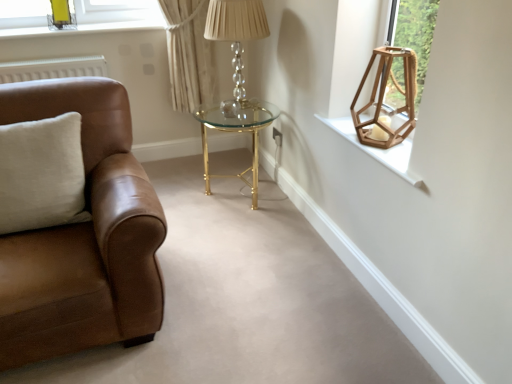
Question: Does crystal glass table lamp at center lie in front of wooden hexagonal lantern at upper right, the 1th lamp in the front-to-back sequence?

Choices:
 (A) no
 (B) yes

Answer: (A)

Question: Can you confirm if crystal glass table lamp at center is wider than wooden hexagonal lantern at upper right, the 1th lamp in the front-to-back sequence?

Choices:
 (A) no
 (B) yes

Answer: (B)

Question: Does crystal glass table lamp at center have a larger size compared to wooden hexagonal lantern at upper right, the 1th lamp positioned from the right?

Choices:
 (A) yes
 (B) no

Answer: (A)

Question: Is crystal glass table lamp at center at the right side of wooden hexagonal lantern at upper right, marked as the second lamp in a back-to-front arrangement?

Choices:
 (A) yes
 (B) no

Answer: (B)

Question: Is crystal glass table lamp at center taller than wooden hexagonal lantern at upper right, the first lamp positioned from the bottom?

Choices:
 (A) yes
 (B) no

Answer: (A)

Question: From a real-world perspective, is gold metallic/glass table at center physically located above or below wooden hexagonal lantern at upper right?

Choices:
 (A) above
 (B) below

Answer: (B)

Question: Choose the correct answer: Is gold metallic/glass table at center inside wooden hexagonal lantern at upper right or outside it?

Choices:
 (A) outside
 (B) inside

Answer: (A)

Question: From the image's perspective, is gold metallic/glass table at center positioned above or below wooden hexagonal lantern at upper right?

Choices:
 (A) above
 (B) below

Answer: (A)

Question: Is gold metallic/glass table at center to the left or to the right of wooden hexagonal lantern at upper right in the image?

Choices:
 (A) right
 (B) left

Answer: (B)

Question: Choose the correct answer: Is crystal glass table lamp at center inside wooden hexagonal lantern at upper right or outside it?

Choices:
 (A) inside
 (B) outside

Answer: (B)

Question: In terms of height, does crystal glass table lamp at center look taller or shorter compared to wooden hexagonal lantern at upper right?

Choices:
 (A) short
 (B) tall

Answer: (B)

Question: Considering the relative positions of crystal glass table lamp at center and wooden hexagonal lantern at upper right in the image provided, is crystal glass table lamp at center to the left or to the right of wooden hexagonal lantern at upper right?

Choices:
 (A) right
 (B) left

Answer: (B)

Question: From the image's perspective, relative to wooden hexagonal lantern at upper right, is crystal glass table lamp at center above or below?

Choices:
 (A) below
 (B) above

Answer: (B)

Question: From the image's perspective, is crystal glass table lamp at center positioned above or below brown leather couch at left?

Choices:
 (A) below
 (B) above

Answer: (B)

Question: From their relative heights in the image, would you say crystal glass table lamp at center is taller or shorter than brown leather couch at left?

Choices:
 (A) tall
 (B) short

Answer: (B)